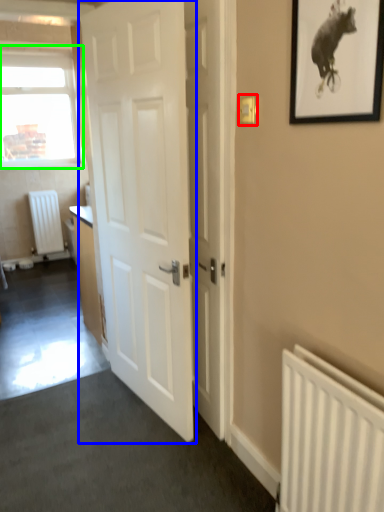
Question: Which object is the farthest from light switch (highlighted by a red box)? Choose among these: door (highlighted by a blue box) or window (highlighted by a green box).

Choices:
 (A) door
 (B) window

Answer: (B)